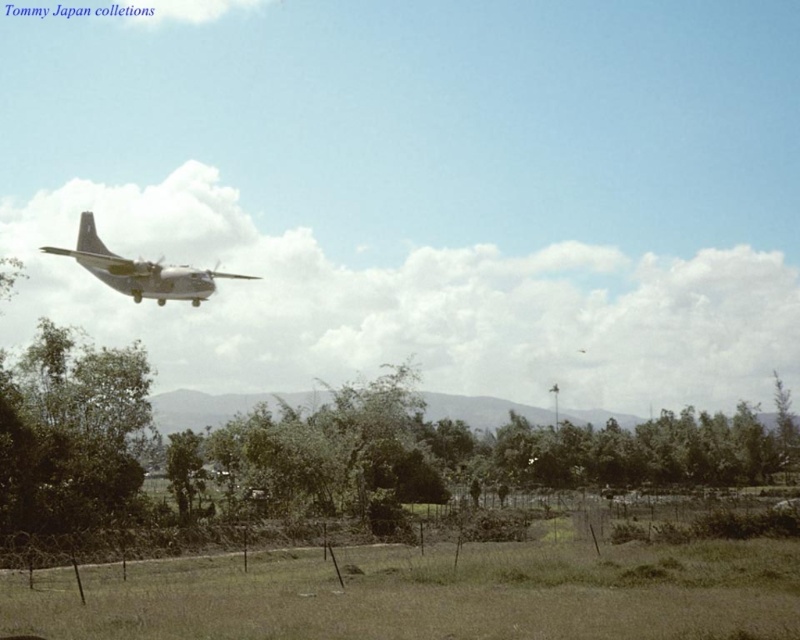
Question: Which point is farther to the camera?

Choices:
 (A) green grass at lower center
 (B) metallic gray airplane at upper left

Answer: (B)

Question: Where is green grass at lower center located in relation to metallic gray airplane at upper left in the image?

Choices:
 (A) above
 (B) below

Answer: (B)

Question: Is green grass at lower center bigger than metallic gray airplane at upper left?

Choices:
 (A) no
 (B) yes

Answer: (B)

Question: Which object is farther from the camera taking this photo?

Choices:
 (A) green grass at lower center
 (B) metallic gray airplane at upper left

Answer: (B)

Question: Does green grass at lower center lie behind metallic gray airplane at upper left?

Choices:
 (A) yes
 (B) no

Answer: (B)